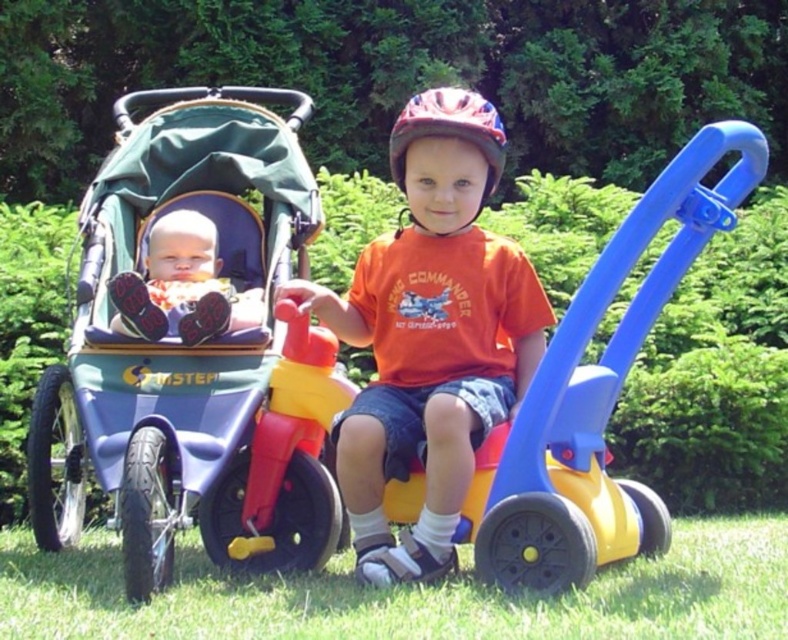
You are a parent trying to choose between two items to pack for a picnic. You have the green fabric stroller at left and the orange matte shirt at center. Based on their sizes, which item would take up more space in your bag?

The green fabric stroller at left has a larger size compared to orange matte shirt at center, so it would take up more space in your bag.